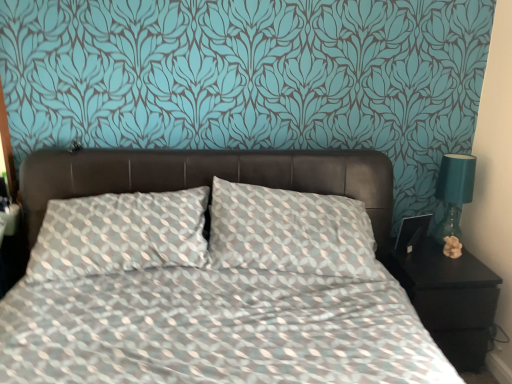
Question: Considering the relative sizes of teal glass lamp at right and black glossy nightstand at lower right in the image provided, is teal glass lamp at right smaller than black glossy nightstand at lower right?

Choices:
 (A) yes
 (B) no

Answer: (A)

Question: Are teal glass lamp at right and black glossy nightstand at lower right located far from each other?

Choices:
 (A) yes
 (B) no

Answer: (B)

Question: From a real-world perspective, is teal glass lamp at right on top of black glossy nightstand at lower right?

Choices:
 (A) yes
 (B) no

Answer: (A)

Question: Is teal glass lamp at right further to camera compared to black glossy nightstand at lower right?

Choices:
 (A) no
 (B) yes

Answer: (B)

Question: Does teal glass lamp at right appear on the left side of black glossy nightstand at lower right?

Choices:
 (A) no
 (B) yes

Answer: (A)

Question: From their relative heights in the image, would you say teal glass lamp at right is taller or shorter than black glossy nightstand at lower right?

Choices:
 (A) tall
 (B) short

Answer: (B)

Question: Relative to black glossy nightstand at lower right, is teal glass lamp at right in front or behind?

Choices:
 (A) front
 (B) behind

Answer: (B)

Question: From a real-world perspective, is teal glass lamp at right positioned above or below black glossy nightstand at lower right?

Choices:
 (A) below
 (B) above

Answer: (B)

Question: Is teal glass lamp at right bigger or smaller than black glossy nightstand at lower right?

Choices:
 (A) small
 (B) big

Answer: (A)

Question: Is black glossy nightstand at lower right to the left or to the right of matte beige figurine at right in the image?

Choices:
 (A) right
 (B) left

Answer: (B)

Question: Relative to matte beige figurine at right, is black glossy nightstand at lower right in front or behind?

Choices:
 (A) front
 (B) behind

Answer: (A)

Question: From the image's perspective, is black glossy nightstand at lower right positioned above or below matte beige figurine at right?

Choices:
 (A) above
 (B) below

Answer: (B)

Question: Considering the positions of point (475, 286) and point (456, 241), is point (475, 286) closer or farther from the camera than point (456, 241)?

Choices:
 (A) farther
 (B) closer

Answer: (B)

Question: Is point (450, 248) positioned closer to the camera than point (457, 228)?

Choices:
 (A) farther
 (B) closer

Answer: (B)

Question: Considering the positions of matte beige figurine at right and teal glass lamp at right in the image, is matte beige figurine at right wider or thinner than teal glass lamp at right?

Choices:
 (A) wide
 (B) thin

Answer: (B)